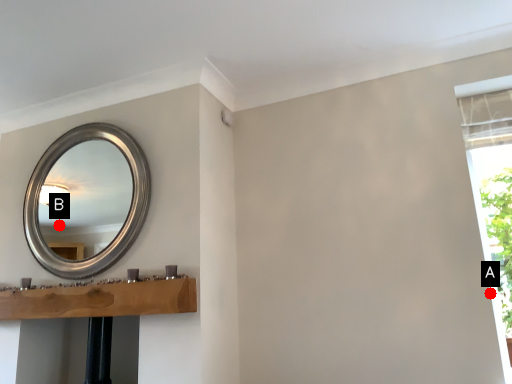
Question: Two points are circled on the image, labeled by A and B beside each circle. Which point appears farthest from the camera in this image?

Choices:
 (A) A is further
 (B) B is further

Answer: (B)